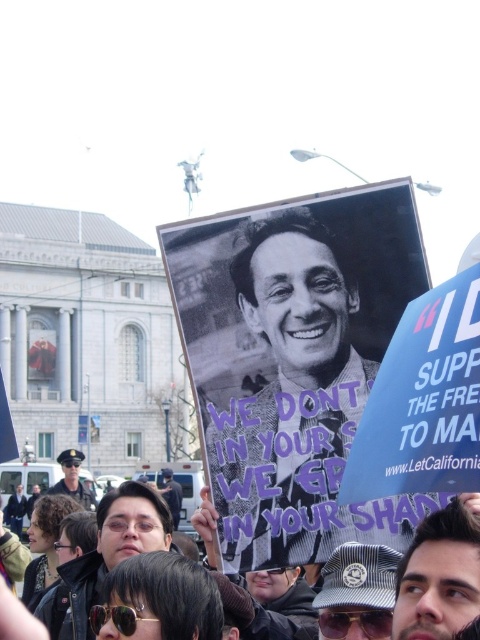
Question: Is dark brown hair at lower right wider than uniformed officer at center?

Choices:
 (A) yes
 (B) no

Answer: (B)

Question: Which object is the farthest from the uniformed officer at center?

Choices:
 (A) black paper poster at center
 (B) striped fabric cap at center

Answer: (B)

Question: Which object is the closest to the matte black sunglasses at center?

Choices:
 (A) uniformed officer at center
 (B) striped fabric cap at center

Answer: (A)

Question: Which point is closer to the camera?

Choices:
 (A) (463, 576)
 (B) (82, 454)
 (C) (304, 196)

Answer: (A)

Question: Is striped fabric cap at center positioned at the back of matte black sunglasses at center?

Choices:
 (A) no
 (B) yes

Answer: (A)

Question: Can you confirm if uniformed officer at center is positioned below matte black sunglasses at center?

Choices:
 (A) yes
 (B) no

Answer: (B)